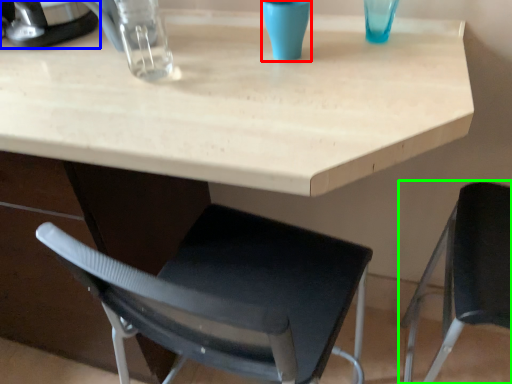
Question: Considering the real-world distances, which object is closest to clear (highlighted by a red box)? appliance (highlighted by a blue box) or chair (highlighted by a green box).

Choices:
 (A) appliance
 (B) chair

Answer: (A)